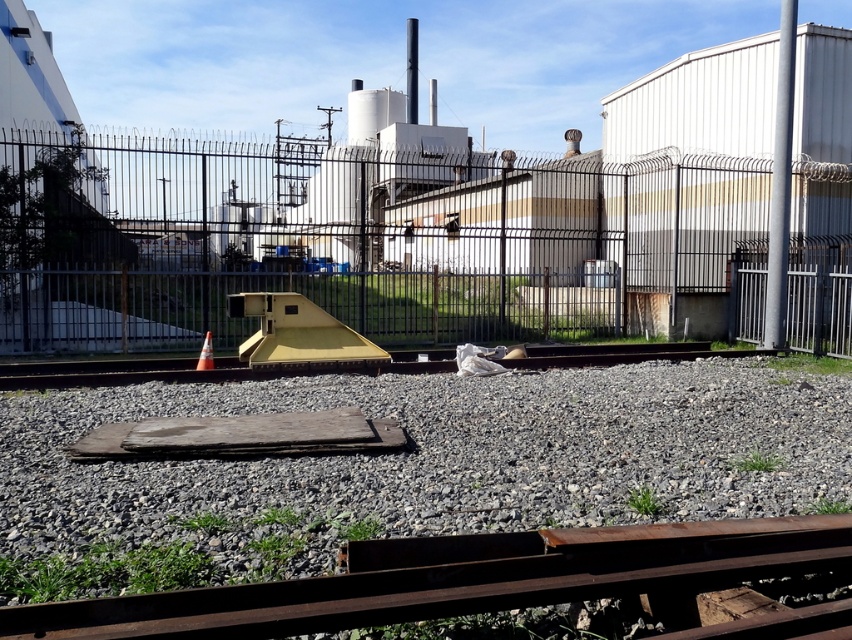
Question: Can you confirm if metallic wire mesh fence at center is positioned below orange reflective cone at center?

Choices:
 (A) no
 (B) yes

Answer: (A)

Question: Is gray gravel at center smaller than orange reflective cone at center?

Choices:
 (A) yes
 (B) no

Answer: (B)

Question: Which of the following is the farthest from the observer?

Choices:
 (A) (262, 282)
 (B) (206, 336)
 (C) (330, 572)
 (D) (850, 541)

Answer: (A)

Question: Can you confirm if metallic wire mesh fence at center is wider than rusty metal train track at lower center?

Choices:
 (A) yes
 (B) no

Answer: (A)

Question: Which is farther from the orange reflective cone at center?

Choices:
 (A) metallic wire mesh fence at center
 (B) gray gravel at center
 (C) rusty metal train track at lower center

Answer: (A)

Question: Among these objects, which one is farthest from the camera?

Choices:
 (A) orange reflective cone at center
 (B) gray gravel at center

Answer: (A)